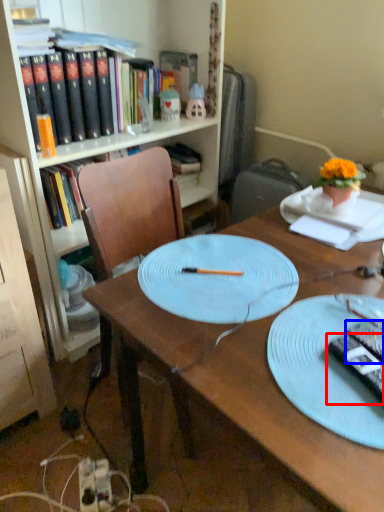
Question: Which of the following is the farthest to the observer, remote control (highlighted by a red box) or remote control (highlighted by a blue box)?

Choices:
 (A) remote control
 (B) remote control

Answer: (B)